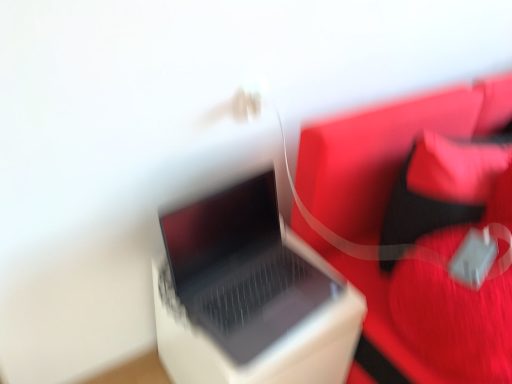
Question: Could you tell me if white plastic laptop at center is turned towards rubberized red bag at right?

Choices:
 (A) no
 (B) yes

Answer: (A)

Question: Is white plastic laptop at center at the right side of rubberized red bag at right?

Choices:
 (A) no
 (B) yes

Answer: (A)

Question: Does white plastic laptop at center lie in front of rubberized red bag at right?

Choices:
 (A) yes
 (B) no

Answer: (B)

Question: Considering the relative sizes of white plastic laptop at center and rubberized red bag at right in the image provided, is white plastic laptop at center bigger than rubberized red bag at right?

Choices:
 (A) yes
 (B) no

Answer: (B)

Question: Considering the relative sizes of white plastic laptop at center and rubberized red bag at right in the image provided, is white plastic laptop at center smaller than rubberized red bag at right?

Choices:
 (A) yes
 (B) no

Answer: (A)

Question: Considering the positions of satin black laptop at center and velvet red bean bag chair at right in the image, is satin black laptop at center wider or thinner than velvet red bean bag chair at right?

Choices:
 (A) thin
 (B) wide

Answer: (A)

Question: In terms of height, does satin black laptop at center look taller or shorter compared to velvet red bean bag chair at right?

Choices:
 (A) short
 (B) tall

Answer: (A)

Question: From the image's perspective, relative to velvet red bean bag chair at right, is satin black laptop at center above or below?

Choices:
 (A) below
 (B) above

Answer: (A)

Question: From a real-world perspective, is satin black laptop at center above or below velvet red bean bag chair at right?

Choices:
 (A) below
 (B) above

Answer: (A)

Question: In terms of height, does satin black laptop at center look taller or shorter compared to rubberized red bag at right?

Choices:
 (A) tall
 (B) short

Answer: (B)

Question: Would you say satin black laptop at center is inside or outside rubberized red bag at right?

Choices:
 (A) outside
 (B) inside

Answer: (A)

Question: From the image's perspective, relative to rubberized red bag at right, is satin black laptop at center above or below?

Choices:
 (A) below
 (B) above

Answer: (A)

Question: In terms of width, does satin black laptop at center look wider or thinner when compared to rubberized red bag at right?

Choices:
 (A) thin
 (B) wide

Answer: (A)

Question: From a real-world perspective, relative to white plastic laptop at center, is rubberized red bag at right vertically above or below?

Choices:
 (A) above
 (B) below

Answer: (A)

Question: In terms of size, does rubberized red bag at right appear bigger or smaller than white plastic laptop at center?

Choices:
 (A) big
 (B) small

Answer: (A)